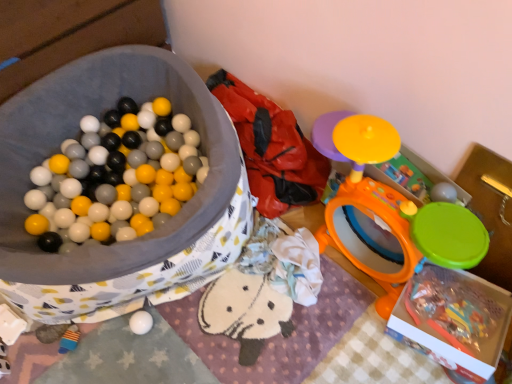
Where is `blank space above translucent plastic storage box at lower right, the first storage box in the right-to-left sequence (from a real-world perspective)`? The height and width of the screenshot is (384, 512). blank space above translucent plastic storage box at lower right, the first storage box in the right-to-left sequence (from a real-world perspective) is located at coordinates (452, 326).